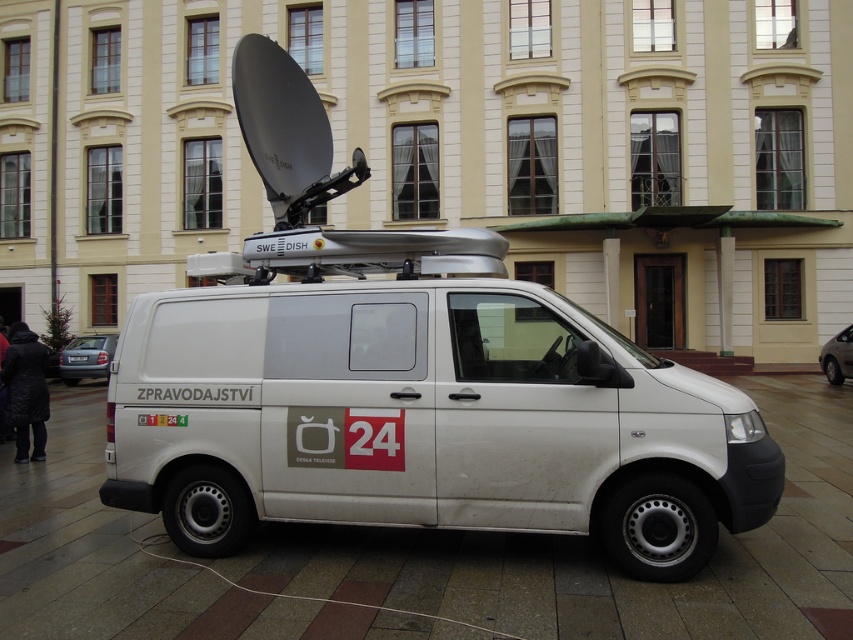
Question: Considering the real-world distances, which object is farthest from the white matte van at center?

Choices:
 (A) matte gray sedan at lower left
 (B) metallic silver sedan at right

Answer: (A)

Question: Can you confirm if white matte van at center is positioned above matte gray sedan at lower left?

Choices:
 (A) yes
 (B) no

Answer: (A)

Question: Estimate the real-world distances between objects in this image. Which object is farther from the metallic silver sedan at right?

Choices:
 (A) white matte van at center
 (B) matte gray sedan at lower left

Answer: (B)

Question: Observing the image, what is the correct spatial positioning of white matte van at center in reference to metallic silver sedan at right?

Choices:
 (A) left
 (B) right

Answer: (A)

Question: Considering the real-world distances, which object is closest to the matte gray sedan at lower left?

Choices:
 (A) metallic silver sedan at right
 (B) white matte van at center

Answer: (B)

Question: Is white matte van at center wider than metallic silver sedan at right?

Choices:
 (A) yes
 (B) no

Answer: (A)